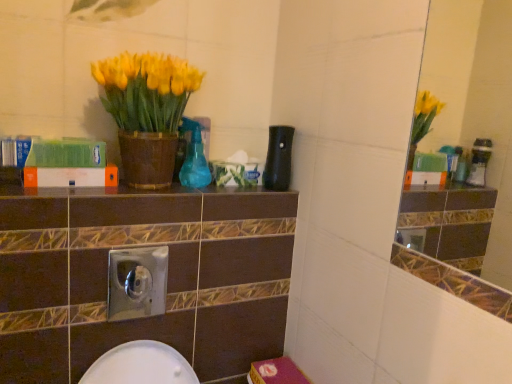
This screenshot has height=384, width=512. Find the location of `free location in front of green matte book at upper left, acting as the 1th book starting from the top`. free location in front of green matte book at upper left, acting as the 1th book starting from the top is located at coordinates (37, 193).